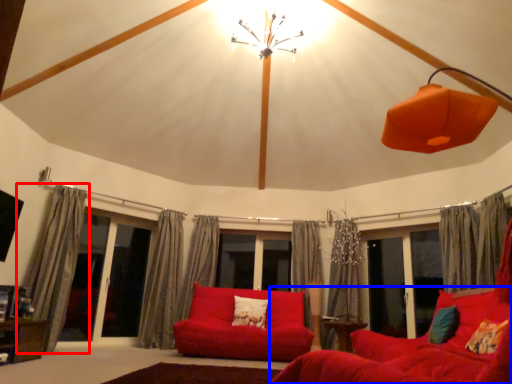
Question: Which object is further to the camera taking this photo, curtain (highlighted by a red box) or studio couch (highlighted by a blue box)?

Choices:
 (A) curtain
 (B) studio couch

Answer: (A)